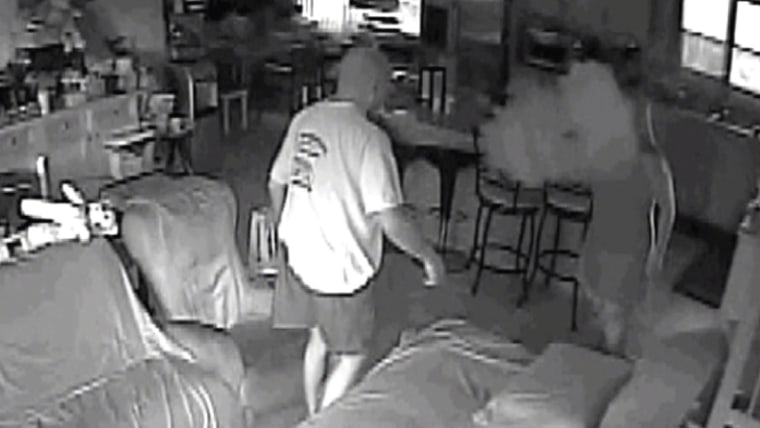
The image size is (760, 428). I want to click on couch, so click(x=125, y=346), click(x=400, y=408).